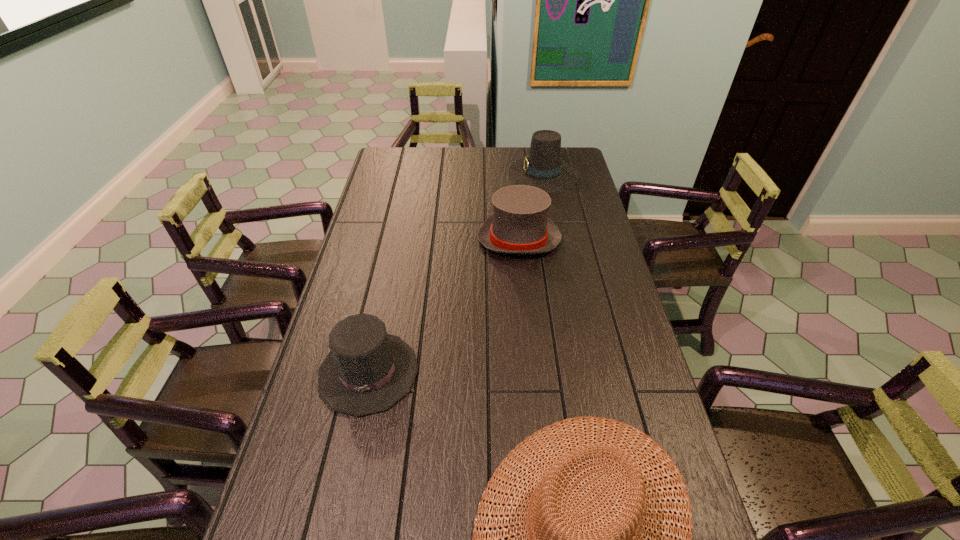
Where is `object at the left edge`? object at the left edge is located at coordinates (367, 371).

You are a GUI agent. You are given a task and a screenshot of the screen. Output one action in this format:
    pyautogui.click(x=<x>, y=<y>)
    Task: Click on the object located at the far right corner
    The width and height of the screenshot is (960, 540).
    Given the screenshot: What is the action you would take?
    pyautogui.click(x=543, y=168)

You are a GUI agent. You are given a task and a screenshot of the screen. Output one action in this format:
    pyautogui.click(x=<x>, y=<y>)
    Task: Click on the blank area at the far edge
    The height and width of the screenshot is (540, 960).
    Given the screenshot: What is the action you would take?
    [514, 153]

At what (x,y) coordinates should I click in order to perform the action: click on free space at the left edge of the desktop. Please return your answer as a coordinate pair (x, y). This screenshot has width=960, height=540. Looking at the image, I should click on (391, 177).

In the image, there is a desktop. Identify the location of blank space at the right edge. (638, 347).

Locate an element on the screen. free space at the far left corner of the desktop is located at coordinates (413, 158).

Find the location of a particular element. vacant space in between the leftmost dress hat and the second farthest dress hat is located at coordinates (444, 306).

The image size is (960, 540). Identify the location of empty space that is in between the second farthest dress hat and the leftmost object. (444, 306).

Identify which object is located as the second nearest to the nearest dress hat. Please provide its 2D coordinates. Your answer should be formatted as a tuple, i.e. [(x, y)], where the tuple contains the x and y coordinates of a point satisfying the conditions above.

[(519, 224)]

The height and width of the screenshot is (540, 960). In order to click on object that ranks as the third closest to the second farthest object in this screenshot , I will do `click(617, 459)`.